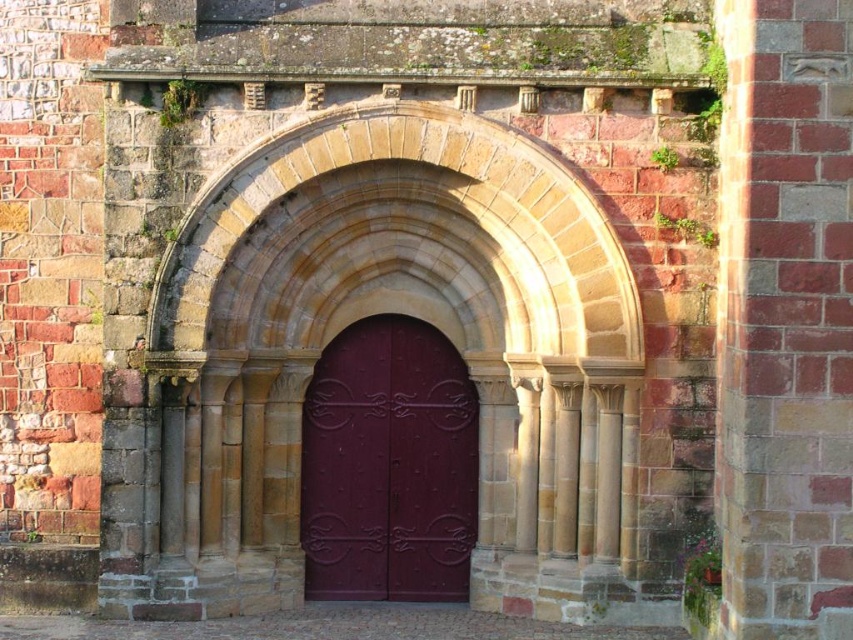
Is stone archway at center to the right of glossy metal door at center from the viewer's perspective?

In fact, stone archway at center is to the left of glossy metal door at center.

Who is positioned more to the left, stone archway at center or glossy metal door at center?

stone archway at center is more to the left.

Between point (561, 481) and point (397, 470), which one is positioned behind?

Positioned behind is point (397, 470).

Where is `stone archway at center`? stone archway at center is located at coordinates (381, 312).